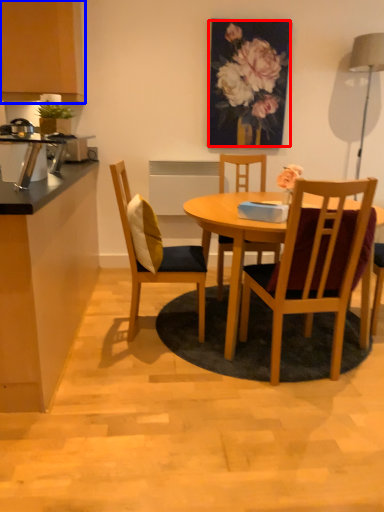
Question: Among these objects, which one is nearest to the camera, floral arrangement (highlighted by a red box) or cabinetry (highlighted by a blue box)?

Choices:
 (A) floral arrangement
 (B) cabinetry

Answer: (B)